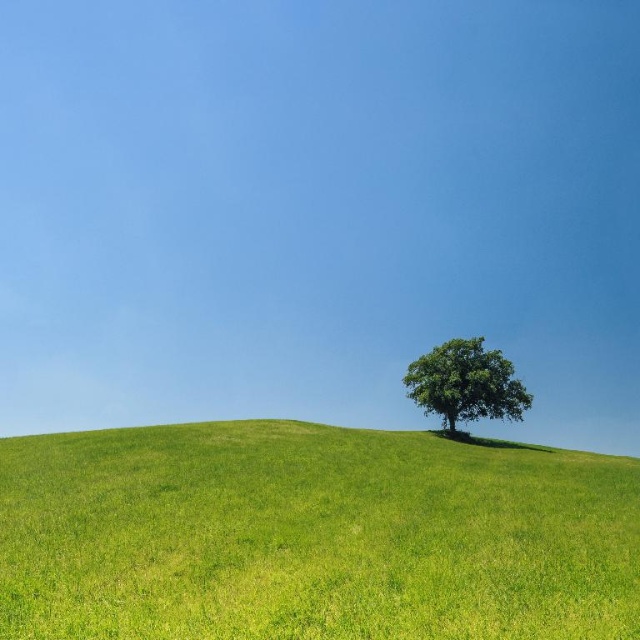
Question: Among these objects, which one is nearest to the camera?

Choices:
 (A) green grassy hillside at center
 (B) green leafy tree at center

Answer: (A)

Question: Considering the relative positions of green grassy hillside at center and green leafy tree at center in the image provided, where is green grassy hillside at center located with respect to green leafy tree at center?

Choices:
 (A) left
 (B) right

Answer: (A)

Question: Which object appears farthest from the camera in this image?

Choices:
 (A) green leafy tree at center
 (B) green grassy hillside at center

Answer: (A)

Question: In this image, where is green grassy hillside at center located relative to green leafy tree at center?

Choices:
 (A) right
 (B) left

Answer: (B)

Question: Can you confirm if green grassy hillside at center is positioned to the left of green leafy tree at center?

Choices:
 (A) yes
 (B) no

Answer: (A)